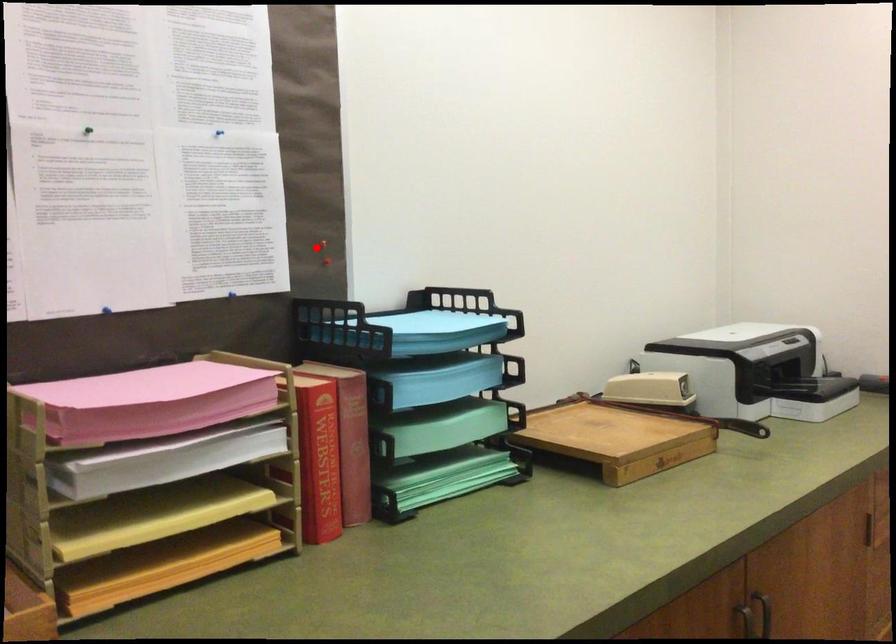
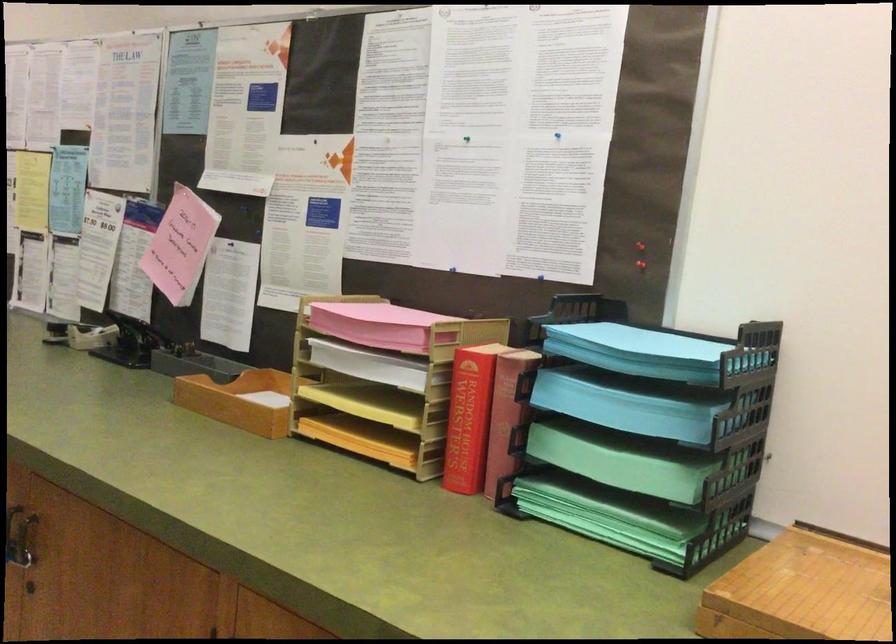
The point at the highlighted location is marked in the first image. Where is the corresponding point in the second image?

(640, 245)